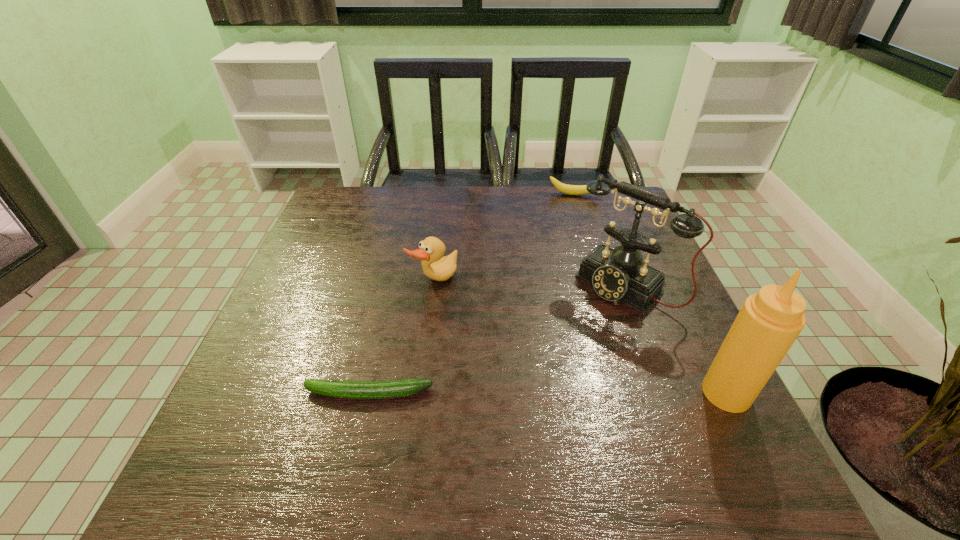
The width and height of the screenshot is (960, 540). Find the location of `free space located on the upward curve of the fourth tallest object`. free space located on the upward curve of the fourth tallest object is located at coordinates (567, 272).

I want to click on free space located 0.370m on the upward curve of the fourth tallest object, so click(567, 275).

This screenshot has height=540, width=960. Find the location of `free space located 0.090m on the upward curve of the fourth tallest object`. free space located 0.090m on the upward curve of the fourth tallest object is located at coordinates (570, 214).

Find the location of a particular element. This screenshot has width=960, height=540. vacant space located 0.230m on the beak of the duck is located at coordinates (522, 347).

Find the location of `vacant space positioned on the beak of the duck`. vacant space positioned on the beak of the duck is located at coordinates tap(548, 367).

Find the location of a particular element. free space located 0.310m on the beak of the duck is located at coordinates (552, 370).

Where is `free spot located 0.270m on the dial of the fourth shortest object`? Image resolution: width=960 pixels, height=540 pixels. free spot located 0.270m on the dial of the fourth shortest object is located at coordinates coord(525,382).

You are a GUI agent. You are given a task and a screenshot of the screen. Output one action in this format:
    pyautogui.click(x=<x>, y=<y>)
    Task: Click on the vacant space situated on the dial of the fourth shortest object
    The height and width of the screenshot is (540, 960).
    Given the screenshot: What is the action you would take?
    pyautogui.click(x=561, y=347)

In order to click on vacant region located 0.400m on the dial of the fourth shortest object in this screenshot , I will do `click(480, 428)`.

At what (x,y) coordinates should I click in order to perform the action: click on object that is at the far edge. Please return your answer as a coordinate pair (x, y). This screenshot has width=960, height=540. Looking at the image, I should click on (564, 188).